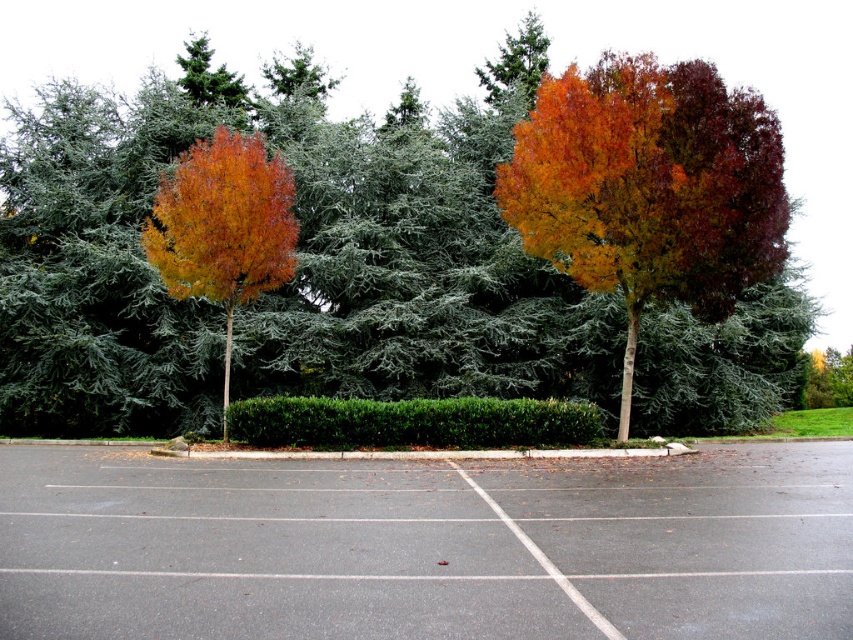
Consider the image. Can you confirm if orange-brown foliage at center is positioned below gray asphalt parking lot at center?

No, orange-brown foliage at center is not below gray asphalt parking lot at center.

Is orange-brown foliage at center above gray asphalt parking lot at center?

Yes, orange-brown foliage at center is above gray asphalt parking lot at center.

The height and width of the screenshot is (640, 853). What do you see at coordinates (297, 252) in the screenshot? I see `orange-brown foliage at center` at bounding box center [297, 252].

Where is `orange-brown foliage at center`? This screenshot has width=853, height=640. orange-brown foliage at center is located at coordinates (297, 252).

Who is more forward, (x=643, y=301) or (x=550, y=440)?

Point (x=550, y=440) is in front.

Describe the element at coordinates (648, 188) in the screenshot. I see `multicolored bark tree at center` at that location.

Find the location of a particular element. multicolored bark tree at center is located at coordinates (648, 188).

The width and height of the screenshot is (853, 640). What do you see at coordinates (297, 252) in the screenshot?
I see `orange-brown foliage at center` at bounding box center [297, 252].

This screenshot has height=640, width=853. Find the location of `orange-brown foliage at center`. orange-brown foliage at center is located at coordinates (297, 252).